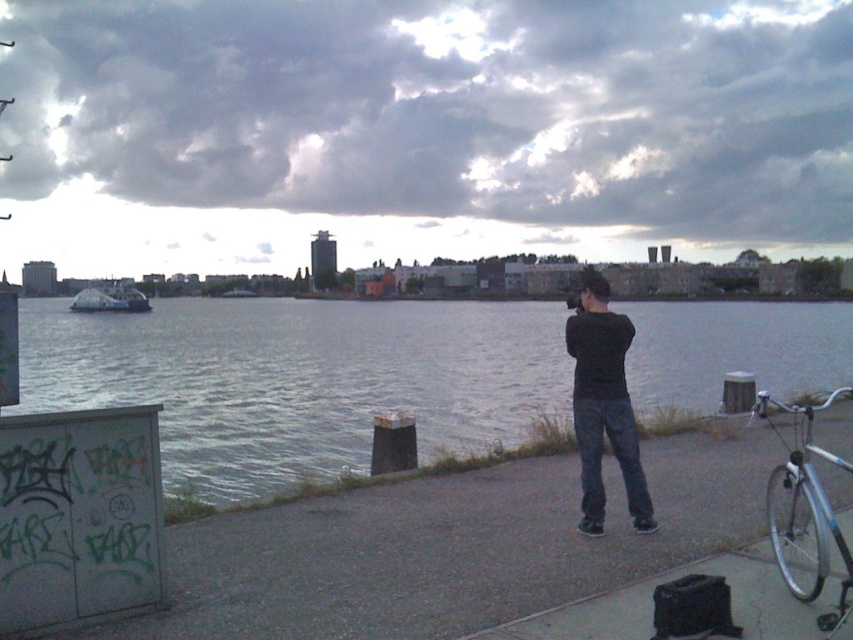
Question: Does black matte pants at center have a lesser width compared to silver metallic bicycle at right?

Choices:
 (A) yes
 (B) no

Answer: (B)

Question: Among these objects, which one is farthest from the camera?

Choices:
 (A) silver metallic bicycle at right
 (B) metallic silver boat at center
 (C) black matte pants at center
 (D) gray water at center

Answer: (B)

Question: Does black matte pants at center appear under silver metallic bicycle at right?

Choices:
 (A) no
 (B) yes

Answer: (A)

Question: Which object is farther from the camera taking this photo?

Choices:
 (A) black matte pants at center
 (B) metallic silver boat at center
 (C) gray water at center

Answer: (B)

Question: Which of the following is the farthest from the observer?

Choices:
 (A) (570, 330)
 (B) (132, 298)
 (C) (294, 413)

Answer: (B)

Question: Does black matte pants at center appear under metallic silver boat at center?

Choices:
 (A) no
 (B) yes

Answer: (B)